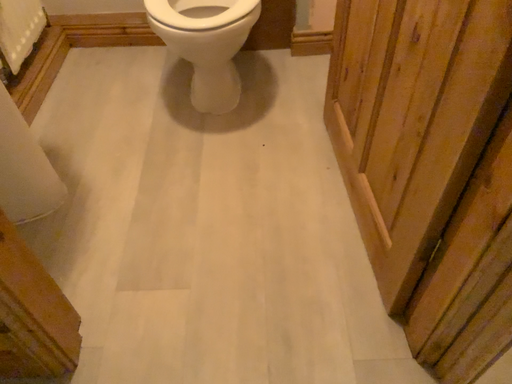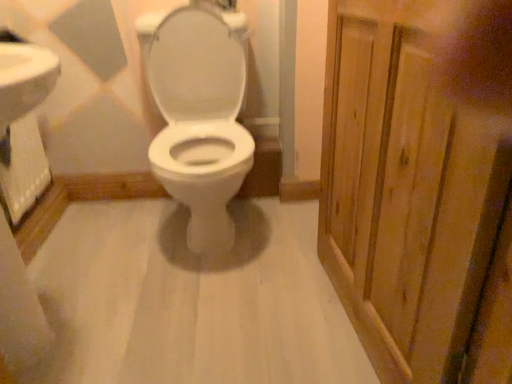
Question: Which way did the camera rotate in the video?

Choices:
 (A) rotated downward
 (B) rotated upward

Answer: (B)